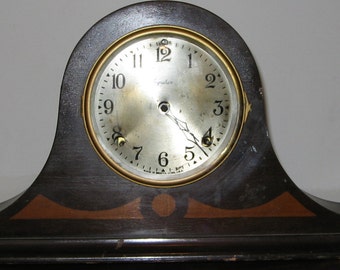
Where is `empty wall space`? The height and width of the screenshot is (270, 340). empty wall space is located at coordinates (312, 77).